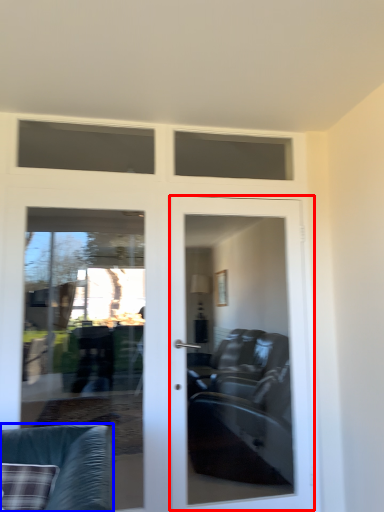
Question: Which object appears closest to the camera in this image, door (highlighted by a red box) or chair (highlighted by a blue box)?

Choices:
 (A) door
 (B) chair

Answer: (B)